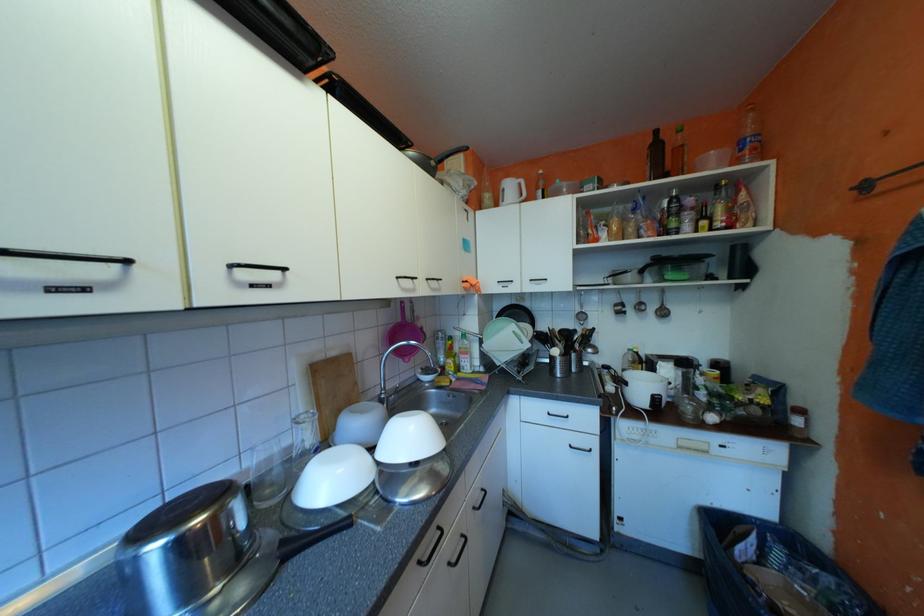
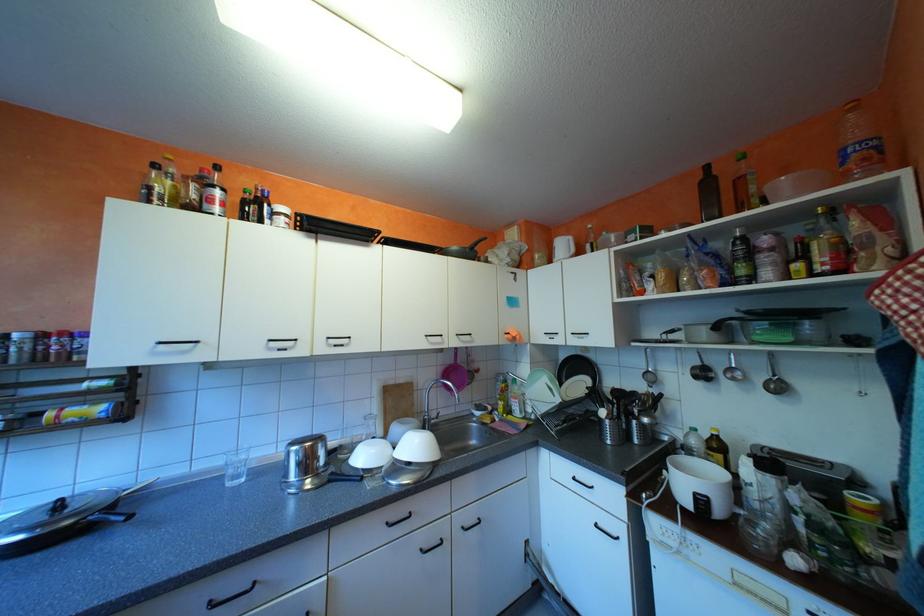
Find the pixel in the second image that matches point 664,395 in the first image.

(708, 493)